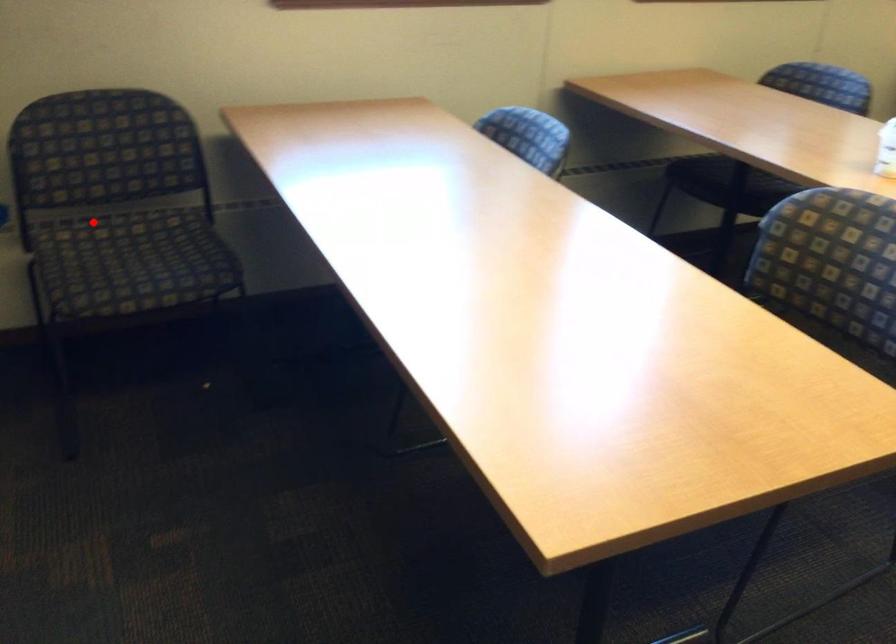
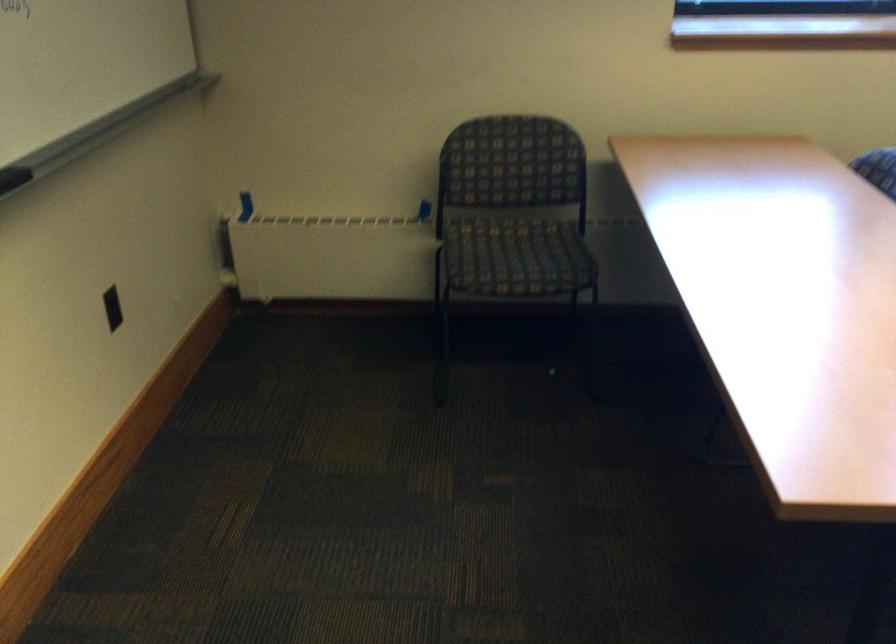
In the second image, find the point that corresponds to the highlighted location in the first image.

(488, 220)